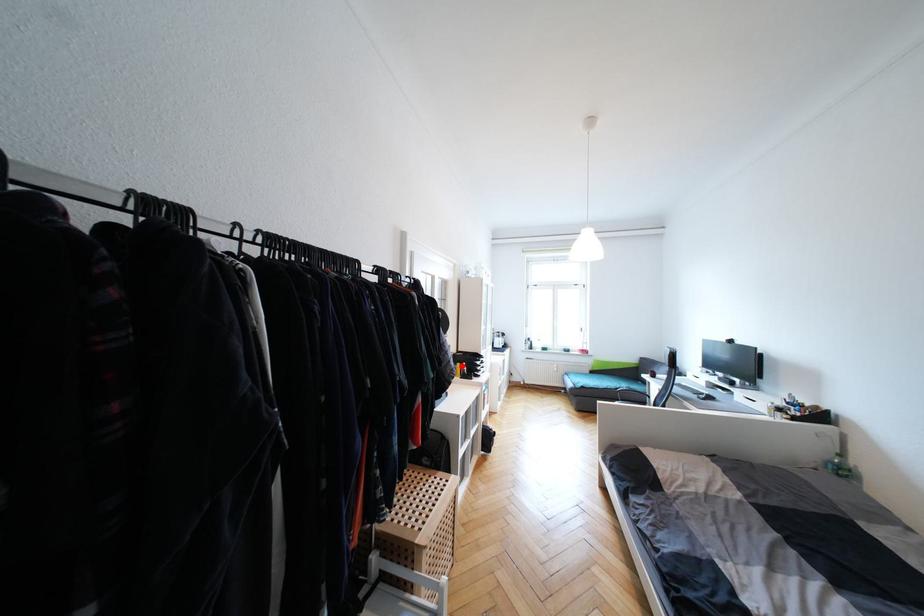
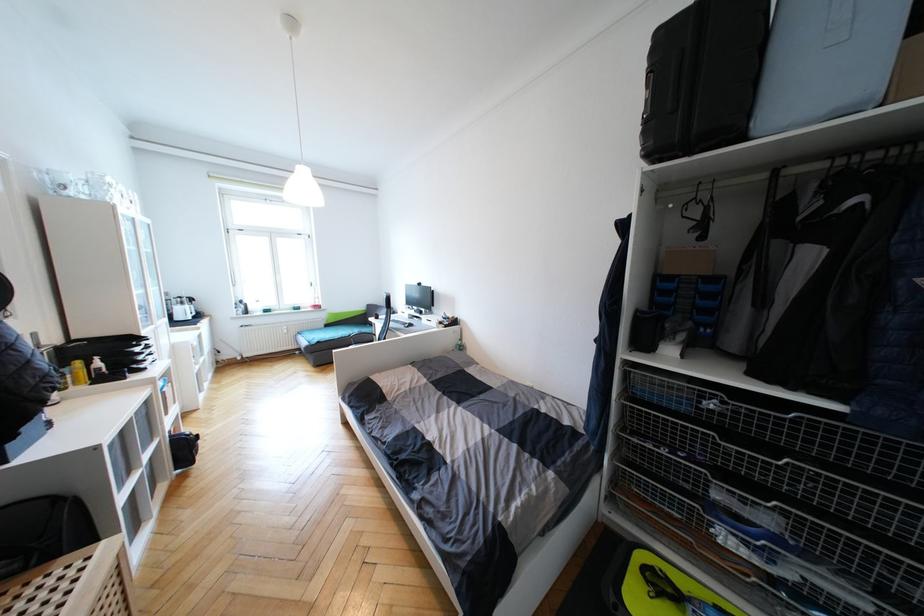
Find the pixel in the second image that matches the highlighted location in the first image.

(81, 363)